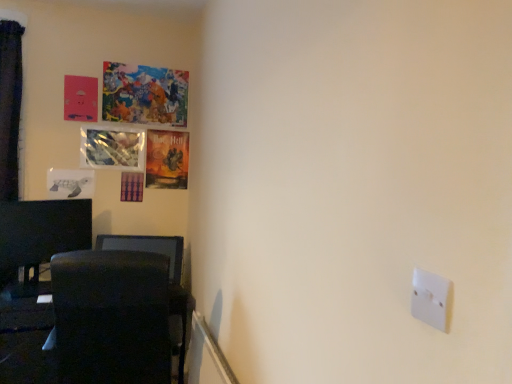
Question: Which is correct: black fabric swivel chair at lower left is inside painted canvas artwork at upper left, the fourth picture frame from the bottom, or outside of it?

Choices:
 (A) outside
 (B) inside

Answer: (A)

Question: From the image's perspective, relative to painted canvas artwork at upper left, the fourth picture frame from the bottom, is black fabric swivel chair at lower left above or below?

Choices:
 (A) below
 (B) above

Answer: (A)

Question: Which of these objects is positioned farthest from the white paper turtle at left, positioned as the 4th picture frame in top-to-bottom order?

Choices:
 (A) metallic reflective picture frame at upper left, which is the second picture frame in top-to-bottom order
 (B) black fabric swivel chair at lower left
 (C) matte paper poster at upper left, which ranks as the third picture frame in top-to-bottom order
 (D) painted canvas artwork at upper left, the fourth picture frame from the bottom
 (E) white plastic light switch at lower right

Answer: (E)

Question: Which object is positioned closest to the black glossy monitor at left?

Choices:
 (A) painted canvas artwork at upper left, the fourth picture frame from the bottom
 (B) white plastic light switch at lower right
 (C) white paper turtle at left, which ranks as the first picture frame in bottom-to-top order
 (D) matte paper poster at upper left, which ranks as the third picture frame in top-to-bottom order
 (E) black fabric swivel chair at lower left

Answer: (C)